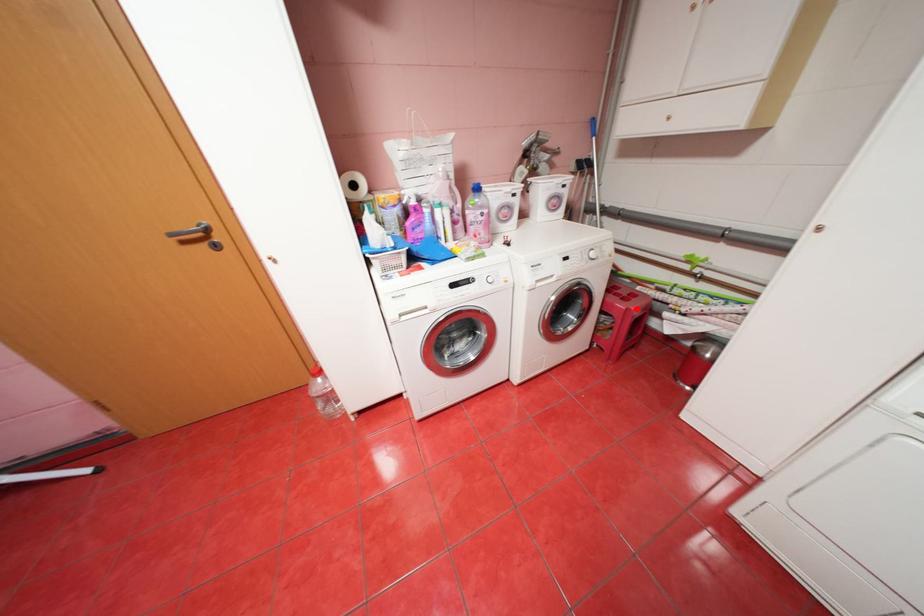
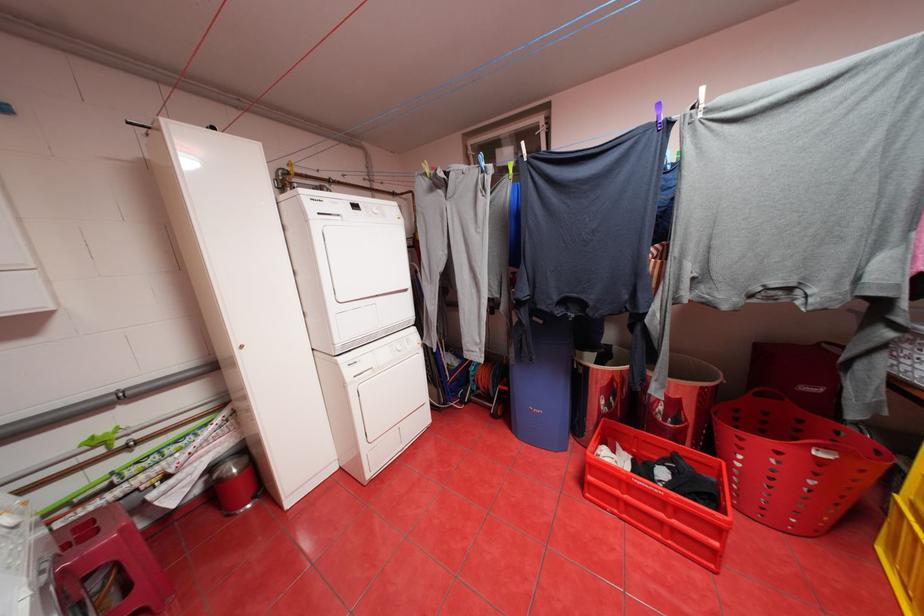
Question: I am providing you with two images of the same scene from different viewpoints. A red point is shown in image1. For the corresponding object point in image2, is it positioned nearer or farther from the camera?

Choices:
 (A) Nearer
 (B) Farther

Answer: (B)